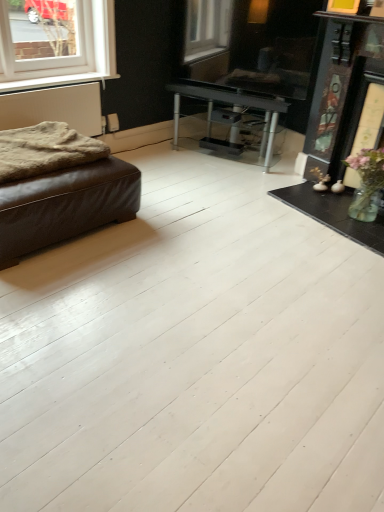
The image size is (384, 512). What do you see at coordinates (60, 188) in the screenshot?
I see `brown leather ottoman at left` at bounding box center [60, 188].

Measure the distance between point [40,143] and camera.

Point [40,143] is 8.20 feet from camera.

The width and height of the screenshot is (384, 512). What are the coordinates of `white textured radiator at left` in the screenshot? It's located at (54, 108).

The image size is (384, 512). I want to click on white matte window sill at upper left, so click(54, 82).

This screenshot has height=512, width=384. I want to click on radiator above the fuzzy woolen blanket at left (from the image's perspective), so click(x=54, y=108).

Does white textured radiator at left have a larger size compared to fuzzy woolen blanket at left?

No.

Measure the distance from white textured radiator at left to fuzzy woolen blanket at left.

The distance of white textured radiator at left from fuzzy woolen blanket at left is 22.17 inches.

Is white textured radiator at left positioned with its back to fuzzy woolen blanket at left?

No, white textured radiator at left is not facing away from fuzzy woolen blanket at left.

Identify the location of window on the right of white textured radiator at left. (64, 56).

From a real-world perspective, which object rests below the other?

From a 3D spatial view, white textured radiator at left is below.

Which is in front, point (37, 93) or point (109, 34)?

The point (37, 93) is more forward.

Considering the relative sizes of brown leather ottoman at left and white textured radiator at left in the image provided, is brown leather ottoman at left wider than white textured radiator at left?

Yes, brown leather ottoman at left is wider than white textured radiator at left.

Is brown leather ottoman at left taller or shorter than white textured radiator at left?

brown leather ottoman at left is shorter than white textured radiator at left.

Is point (83, 179) in front of point (69, 112)?

Yes, it is in front of point (69, 112).

Considering the relative positions of white matte window sill at upper left and fuzzy woolen blanket at left in the image provided, is white matte window sill at upper left behind fuzzy woolen blanket at left?

Yes, white matte window sill at upper left is further from the viewer.

Is white matte window sill at upper left far away from fuzzy woolen blanket at left?

That's not correct — white matte window sill at upper left is a little close to fuzzy woolen blanket at left.

From the image's perspective, does white matte window sill at upper left appear higher than fuzzy woolen blanket at left?

Yes, from the image's perspective, white matte window sill at upper left is on top of fuzzy woolen blanket at left.

Is brown leather ottoman at left smaller than fuzzy woolen blanket at left?

No.

Which is behind, point (70, 129) or point (5, 148)?

The point (70, 129) is more distant.

You are a GUI agent. You are given a task and a screenshot of the screen. Output one action in this format:
    pyautogui.click(x=<x>, y=<y>)
    Task: Click on the studio couch below the fuzzy woolen blanket at left (from the image's perspective)
    
    Given the screenshot: What is the action you would take?
    click(60, 188)

What's the angular difference between fuzzy woolen blanket at left and white matte window sill at upper left's facing directions?

There is a 4-degree angle between the facing directions of fuzzy woolen blanket at left and white matte window sill at upper left.

From a real-world perspective, is fuzzy woolen blanket at left positioned over white matte window sill at upper left based on gravity?

No, from a real-world perspective, fuzzy woolen blanket at left is not above white matte window sill at upper left.

From the image's perspective, is fuzzy woolen blanket at left positioned above or below white matte window sill at upper left?

From the image's perspective, fuzzy woolen blanket at left appears below white matte window sill at upper left.

You are a GUI agent. You are given a task and a screenshot of the screen. Output one action in this format:
    pyautogui.click(x=<x>, y=<y>)
    Task: Click on the blanket in front of the white matte window sill at upper left
    
    Given the screenshot: What is the action you would take?
    pyautogui.click(x=45, y=150)

Is white textured radiator at left touching brown leather ottoman at left?

No, white textured radiator at left is not beside brown leather ottoman at left.

Could you tell me if white textured radiator at left is turned towards brown leather ottoman at left?

Yes, white textured radiator at left is facing brown leather ottoman at left.

Which object is further away from the camera, white textured radiator at left or brown leather ottoman at left?

white textured radiator at left is further away from the camera.

Where is `blanket below the white textured radiator at left (from the image's perspective)`? The height and width of the screenshot is (512, 384). blanket below the white textured radiator at left (from the image's perspective) is located at coordinates (45, 150).

You are a GUI agent. You are given a task and a screenshot of the screen. Output one action in this format:
    pyautogui.click(x=<x>, y=<y>)
    Task: Click on the window that is above the white textured radiator at left (from a real-world perspective)
    The height and width of the screenshot is (512, 384).
    Given the screenshot: What is the action you would take?
    pyautogui.click(x=64, y=56)

From the image, which object appears to be nearer to fuzzy woolen blanket at left, brown leather ottoman at left or white textured radiator at left?

Among the two, brown leather ottoman at left is located nearer to fuzzy woolen blanket at left.

Considering their positions, is white textured radiator at left positioned closer to white matte window sill at upper left than fuzzy woolen blanket at left?

white textured radiator at left lies closer to white matte window sill at upper left than the other object.

Based on their spatial positions, is white matte window sill at upper left or white textured radiator at left further from white plastic window at upper left?

The object further to white plastic window at upper left is white textured radiator at left.

Estimate the real-world distances between objects in this image. Which object is closer to white matte window sill at upper left, white textured radiator at left or brown leather ottoman at left?

Based on the image, white textured radiator at left appears to be nearer to white matte window sill at upper left.

Considering their positions, is white plastic window at upper left positioned further to white textured radiator at left than fuzzy woolen blanket at left?

fuzzy woolen blanket at left is positioned further to the anchor white textured radiator at left.

Looking at the image, which one is located further to brown leather ottoman at left, white matte window sill at upper left or fuzzy woolen blanket at left?

white matte window sill at upper left is positioned further to the anchor brown leather ottoman at left.

From the image, which object appears to be farther from white plastic window at upper left, fuzzy woolen blanket at left or brown leather ottoman at left?

Among the two, brown leather ottoman at left is located further to white plastic window at upper left.

Considering their positions, is fuzzy woolen blanket at left positioned closer to white matte window sill at upper left than brown leather ottoman at left?

Among the two, fuzzy woolen blanket at left is located nearer to white matte window sill at upper left.

Image resolution: width=384 pixels, height=512 pixels. Identify the location of radiator between white plastic window at upper left and brown leather ottoman at left in the vertical direction. (54, 108).

Where is `radiator positioned between brown leather ottoman at left and white matte window sill at upper left from near to far`? radiator positioned between brown leather ottoman at left and white matte window sill at upper left from near to far is located at coordinates (54, 108).

The width and height of the screenshot is (384, 512). What are the coordinates of `window sill between white plastic window at upper left and fuzzy woolen blanket at left from top to bottom` in the screenshot? It's located at (54, 82).

Where is `radiator between white plastic window at upper left and fuzzy woolen blanket at left from top to bottom`? The width and height of the screenshot is (384, 512). radiator between white plastic window at upper left and fuzzy woolen blanket at left from top to bottom is located at coordinates point(54,108).